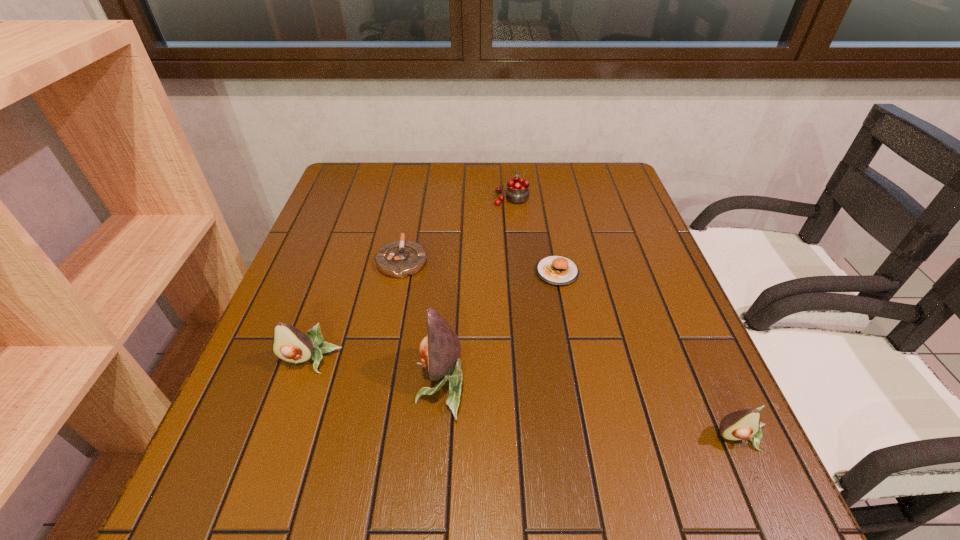
Where is `the leftmost avocado`? Image resolution: width=960 pixels, height=540 pixels. the leftmost avocado is located at coordinates (289, 344).

Identify the location of the second shortest avocado. (289, 344).

The image size is (960, 540). I want to click on the third object from left to right, so click(x=440, y=351).

In order to click on the tallest object in this screenshot , I will do tap(440, 351).

Locate an element on the screen. the shortest avocado is located at coordinates (745, 424).

The width and height of the screenshot is (960, 540). Find the location of `the rightmost object`. the rightmost object is located at coordinates (745, 424).

Image resolution: width=960 pixels, height=540 pixels. Identify the location of food. (555, 270).

Where is `the farthest object`? The width and height of the screenshot is (960, 540). the farthest object is located at coordinates (517, 191).

Locate an element on the screen. This screenshot has height=540, width=960. ashtray is located at coordinates (399, 259).

Locate an element on the screen. The width and height of the screenshot is (960, 540). vacant space located 0.140m on the seed side of the second tallest object is located at coordinates (282, 443).